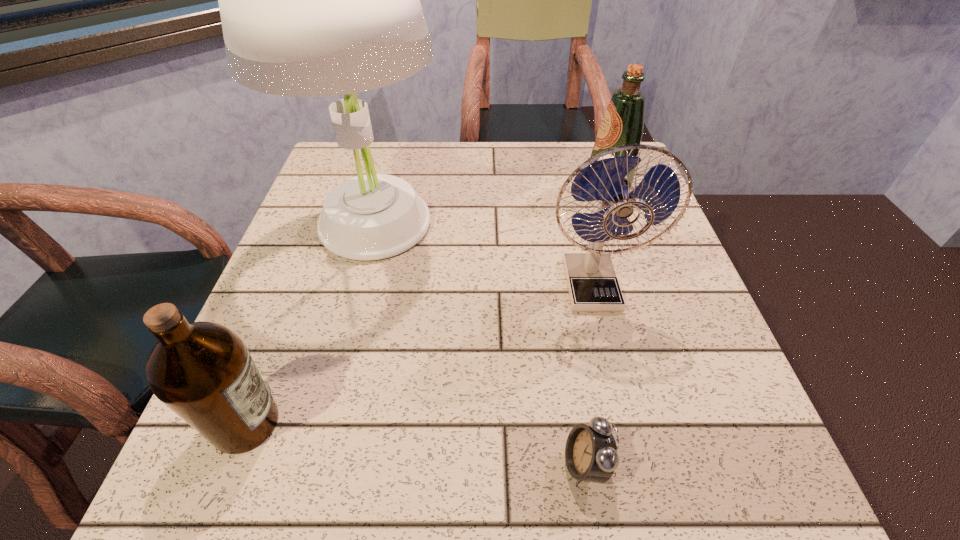
The width and height of the screenshot is (960, 540). What are the coordinates of `fan located at the right edge` in the screenshot? It's located at (592, 283).

Where is `olive oil present at the right edge`? The height and width of the screenshot is (540, 960). olive oil present at the right edge is located at coordinates (623, 122).

At what (x,y) coordinates should I click in order to perform the action: click on object located in the far left corner section of the desktop. Please return your answer as a coordinate pair (x, y). This screenshot has height=540, width=960. Looking at the image, I should click on (316, 0).

This screenshot has height=540, width=960. What are the coordinates of `object at the near left corner` in the screenshot? It's located at (203, 371).

The height and width of the screenshot is (540, 960). Find the location of `object that is at the far right corner`. object that is at the far right corner is located at coordinates (623, 122).

Locate an element on the screen. The height and width of the screenshot is (540, 960). vacant space at the far edge is located at coordinates (505, 158).

In the image, there is a desktop. Find the location of `free space at the near edge`. free space at the near edge is located at coordinates (613, 485).

The height and width of the screenshot is (540, 960). In the image, there is a desktop. In order to click on free space at the left edge in this screenshot , I will do `click(316, 368)`.

You are a GUI agent. You are given a task and a screenshot of the screen. Output one action in this format:
    pyautogui.click(x=<x>, y=<y>)
    Task: Click on the free location at the right edge of the desktop
    This screenshot has height=540, width=960.
    Given the screenshot: What is the action you would take?
    pyautogui.click(x=666, y=358)

The height and width of the screenshot is (540, 960). In order to click on free region at the far left corner in this screenshot , I will do `click(333, 167)`.